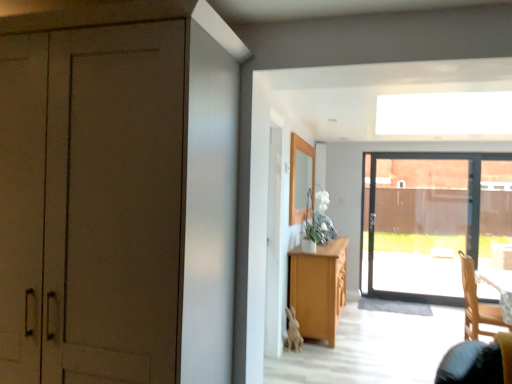
Describe the element at coordinates (318, 288) in the screenshot. The width and height of the screenshot is (512, 384). I see `light wood cabinet at center` at that location.

Measure the distance between point (x=305, y=323) and camera.

The distance of point (x=305, y=323) from camera is 13.58 feet.

The image size is (512, 384). What do you see at coordinates (91, 204) in the screenshot?
I see `matte brown cabinet at left` at bounding box center [91, 204].

The height and width of the screenshot is (384, 512). I want to click on light wood cabinet at center, so click(318, 288).

Is light wood cabinet at center wider than wooden chair at lower right?

In fact, light wood cabinet at center might be narrower than wooden chair at lower right.

Between light wood cabinet at center and wooden chair at lower right, which one appears on the left side from the viewer's perspective?

light wood cabinet at center.

The width and height of the screenshot is (512, 384). I want to click on chair on the right side of light wood cabinet at center, so click(x=476, y=303).

What's the angular difference between matte brown cabinet at left and wooden chair at lower right's facing directions?

89.6 degrees separate the facing orientations of matte brown cabinet at left and wooden chair at lower right.

You are a GUI agent. You are given a task and a screenshot of the screen. Output one action in this format:
    pyautogui.click(x=<x>, y=<y>)
    Task: Click on the door above the wooden chair at lower right (from the image's perspective)
    This screenshot has height=384, width=512.
    Given the screenshot: What is the action you would take?
    pyautogui.click(x=91, y=204)

Between matte brown cabinet at left and wooden chair at lower right, which one appears on the left side from the viewer's perspective?

matte brown cabinet at left.

Can you confirm if matte brown cabinet at left is bigger than wooden chair at lower right?

Indeed, matte brown cabinet at left has a larger size compared to wooden chair at lower right.

Does point (490, 332) come closer to viewer compared to point (1, 108)?

That is False.

From a real-world perspective, is wooden chair at lower right over matte brown cabinet at left?

No, from a real-world perspective, wooden chair at lower right is not above matte brown cabinet at left.

Consider the image. Is wooden chair at lower right to the left or to the right of matte brown cabinet at left in the image?

Clearly, wooden chair at lower right is on the right of matte brown cabinet at left in the image.

Is wooden chair at lower right taller than matte brown cabinet at left?

In fact, wooden chair at lower right may be shorter than matte brown cabinet at left.

Is light wood cabinet at center far from matte brown cabinet at left?

light wood cabinet at center is positioned a significant distance from matte brown cabinet at left.

Does light wood cabinet at center have a lesser width compared to matte brown cabinet at left?

Yes, light wood cabinet at center is thinner than matte brown cabinet at left.

From a real-world perspective, which is physically below, light wood cabinet at center or matte brown cabinet at left?

In real-world perspective, light wood cabinet at center is lower.

From the image's perspective, is light wood cabinet at center located beneath matte brown cabinet at left?

Yes.

Which object is positioned more to the left, matte brown cabinet at left or light wood cabinet at center?

matte brown cabinet at left.

Which is behind, point (40, 294) or point (315, 293)?

The point (315, 293) is farther.

Does matte brown cabinet at left have a larger size compared to light wood cabinet at center?

Yes.

Is wooden chair at lower right taller than light wood cabinet at center?

Correct, wooden chair at lower right is much taller as light wood cabinet at center.

Is wooden chair at lower right not near light wood cabinet at center?

Yes.

Image resolution: width=512 pixels, height=384 pixels. Find the location of `chair above the light wood cabinet at center (from a real-world perspective)`. chair above the light wood cabinet at center (from a real-world perspective) is located at coordinates (476, 303).

From the picture: Considering the positions of objects wooden chair at lower right and light wood cabinet at center in the image provided, who is behind, wooden chair at lower right or light wood cabinet at center?

Positioned behind is light wood cabinet at center.

I want to click on chair below the light wood cabinet at center (from the image's perspective), so click(476, 303).

Image resolution: width=512 pixels, height=384 pixels. Find the location of `chair on the right of matte brown cabinet at left`. chair on the right of matte brown cabinet at left is located at coordinates (476, 303).

Estimate the real-world distances between objects in this image. Which object is further from wooden chair at lower right, matte brown cabinet at left or light wood cabinet at center?

Based on the image, matte brown cabinet at left appears to be further to wooden chair at lower right.

Estimate the real-world distances between objects in this image. Which object is closer to matte brown cabinet at left, light wood cabinet at center or wooden chair at lower right?

light wood cabinet at center lies closer to matte brown cabinet at left than the other object.

When comparing their distances from wooden chair at lower right, does light wood cabinet at center or matte brown cabinet at left seem further?

matte brown cabinet at left.

Considering their positions, is matte brown cabinet at left positioned closer to light wood cabinet at center than wooden chair at lower right?

Among the two, wooden chair at lower right is located nearer to light wood cabinet at center.

Which object lies further to the anchor point light wood cabinet at center, wooden chair at lower right or matte brown cabinet at left?

matte brown cabinet at left is positioned further to the anchor light wood cabinet at center.

Looking at the image, which one is located closer to matte brown cabinet at left, wooden chair at lower right or light wood cabinet at center?

Among the two, light wood cabinet at center is located nearer to matte brown cabinet at left.

Locate an element on the screen. cabinetry located between matte brown cabinet at left and wooden chair at lower right in the left-right direction is located at coordinates (318, 288).